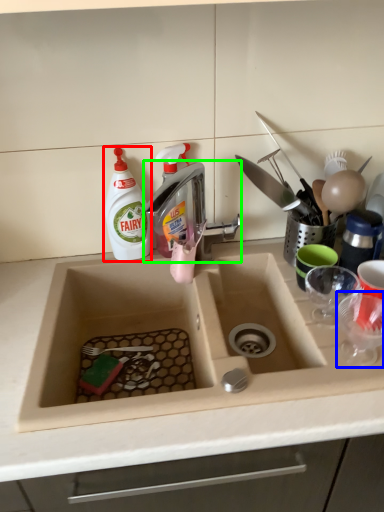
Question: Based on their relative distances, which object is nearer to cleaning product (highlighted by a red box)? Choose from tableware (highlighted by a blue box) and tap (highlighted by a green box).

Choices:
 (A) tableware
 (B) tap

Answer: (B)